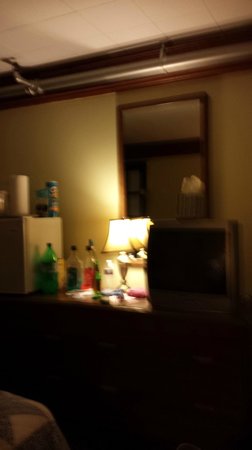
Image resolution: width=252 pixels, height=450 pixels. What are the coordinates of `paper towels` in the screenshot? It's located at (21, 194).